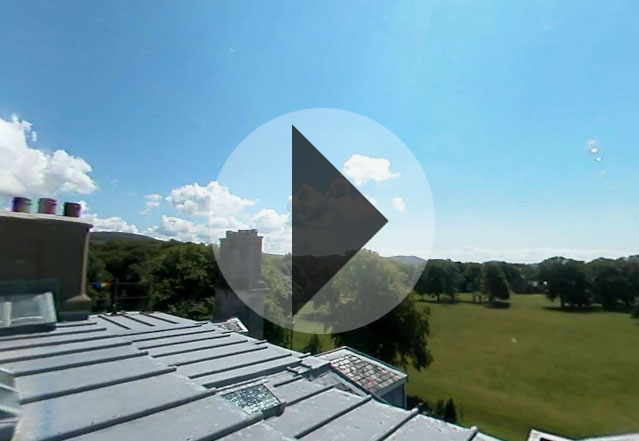
The height and width of the screenshot is (441, 639). Identify the location of chimney. (68, 275).